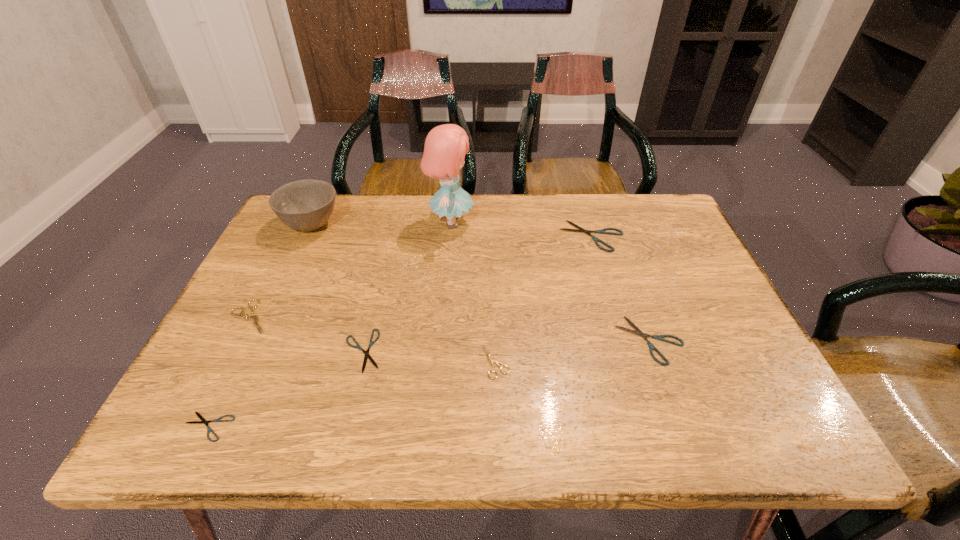
Find the location of a particular element. free space located 0.220m on the left of the third biggest black shears is located at coordinates (241, 350).

The image size is (960, 540). What are the coordinates of `free spot located 0.200m on the back of the nearest black shears` in the screenshot? It's located at (254, 331).

Locate an element on the screen. Image resolution: width=960 pixels, height=540 pixels. doll positioned at the far edge is located at coordinates (445, 147).

At what (x,y) coordinates should I click in order to perform the action: click on bowl positioned at the far edge. Please return your answer as a coordinate pair (x, y). Looking at the image, I should click on (305, 205).

Find the location of a particular element. shears that is at the far edge is located at coordinates (602, 231).

Locate an element on the screen. object located at the near edge is located at coordinates (203, 420).

Locate an element on the screen. The width and height of the screenshot is (960, 540). bowl that is positioned at the left edge is located at coordinates (305, 205).

Where is `object at the right edge`? object at the right edge is located at coordinates (659, 337).

At what (x,y) coordinates should I click in order to perform the action: click on object located at the far left corner. Please return your answer as a coordinate pair (x, y). This screenshot has height=540, width=960. Looking at the image, I should click on (305, 205).

Find the location of a particular element. object present at the near left corner is located at coordinates (203, 420).